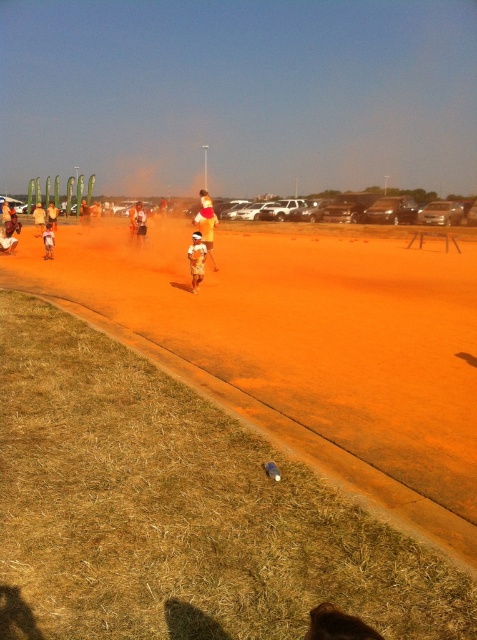
You are a photographer trying to capture a photo of the yellow fabric shirt at center and the orange fabric shorts at center. If your camera has a maximum focus range of 10 feet, will you be able to focus on both subjects simultaneously?

The yellow fabric shirt at center is 10.42 feet from the orange fabric shorts at center, which exceeds the camera maximum focus range of 10 feet. Therefore, you cannot focus on both subjects simultaneously.

You are a photographer at the color run event. You want to capture a photo of the orange fabric shorts at center and the light brown cotton shorts at center. Based on their positions, which one appears lower in the photo?

The orange fabric shorts at center appears lower in the photo since it is located below the light brown cotton shorts at center.

You are a photographer at the color run event. You want to capture a photo of the orange fabric shorts at center and the light brown cotton shorts at center. Which pair of shorts will appear taller in the photo?

The orange fabric shorts at center will appear taller in the photo because it is much taller than the light brown cotton shorts at center according to the description.